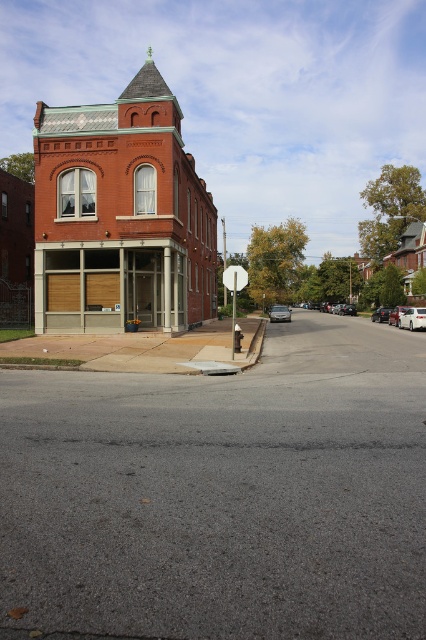
Does asphalt at center appear under metallic silver sedan at center?

Yes, asphalt at center is below metallic silver sedan at center.

Who is lower down, asphalt at center or metallic silver sedan at center?

asphalt at center

Is point (230, 520) positioned after point (379, 314)?

No, it is in front of (379, 314).

The image size is (426, 640). Find the location of `asphalt at center`. asphalt at center is located at coordinates (221, 493).

Is silver metallic sedan at center to the right of metallic silver sedan at center from the viewer's perspective?

In fact, silver metallic sedan at center is to the left of metallic silver sedan at center.

Between silver metallic sedan at center and metallic silver sedan at center, which one has more height?

With more height is silver metallic sedan at center.

Where is `silver metallic sedan at center`? The height and width of the screenshot is (640, 426). silver metallic sedan at center is located at coordinates (412, 317).

Does metallic silver sedan at center appear under white glossy sedan at right?

Yes, metallic silver sedan at center is below white glossy sedan at right.

Which of these two, metallic silver sedan at center or white glossy sedan at right, stands taller?

white glossy sedan at right

Between point (379, 307) and point (402, 308), which one is positioned behind?

Positioned behind is point (379, 307).

In order to click on metallic silver sedan at center in this screenshot , I will do `click(380, 314)`.